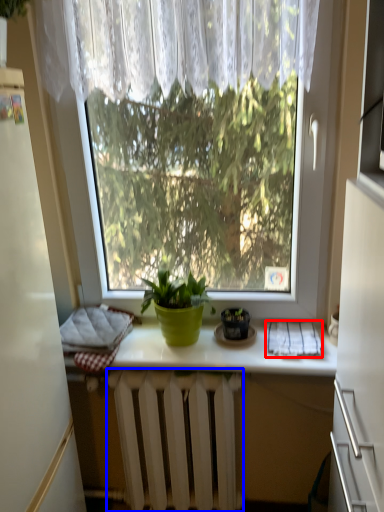
Question: Which object is further to the camera taking this photo, cloth (highlighted by a red box) or radiator (highlighted by a blue box)?

Choices:
 (A) cloth
 (B) radiator

Answer: (B)